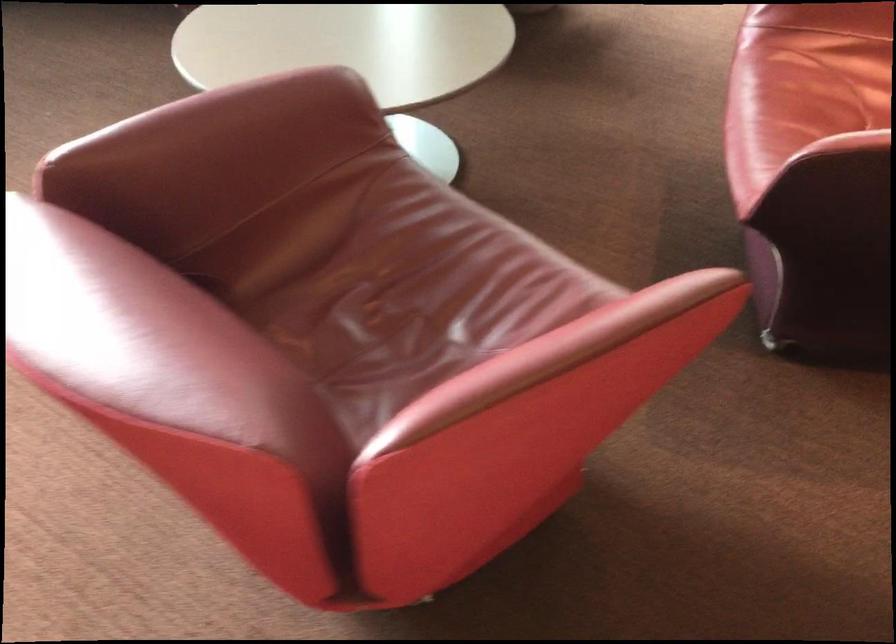
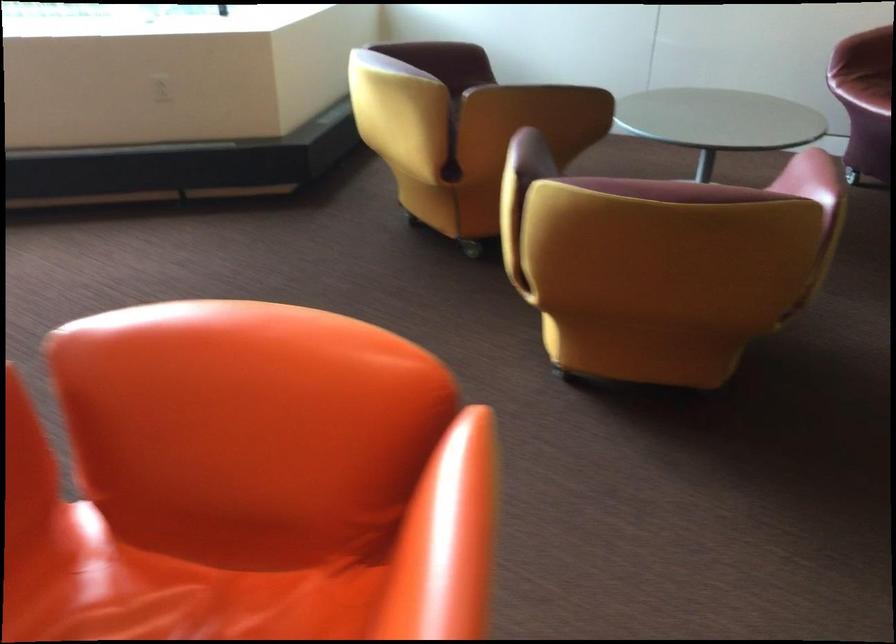
Question: The images are taken continuously from a first-person perspective. In which direction are you moving?

Choices:
 (A) Left
 (B) Right
 (C) Forward
 (D) Backward

Answer: (B)